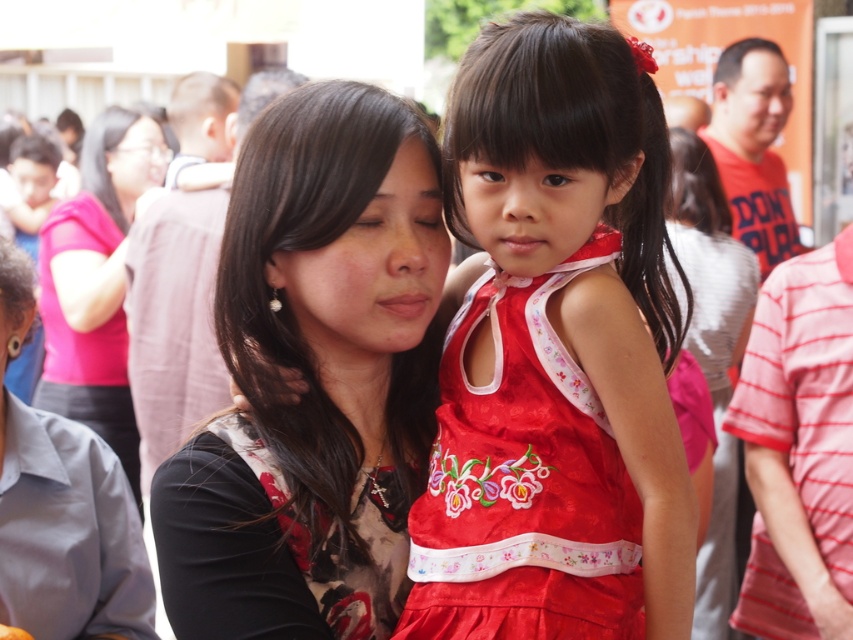
Question: Which object is the farthest from the black floral dress at center?

Choices:
 (A) matte black shirt at center
 (B) silky red dress at center

Answer: (A)

Question: Can you confirm if black floral dress at center is smaller than matte black shirt at center?

Choices:
 (A) yes
 (B) no

Answer: (A)

Question: Which object appears farthest from the camera in this image?

Choices:
 (A) silky red dress at center
 (B) black floral dress at center

Answer: (B)

Question: Is silky red dress at center wider than matte black shirt at center?

Choices:
 (A) no
 (B) yes

Answer: (A)

Question: Based on their relative distances, which object is nearer to the silky red dress at center?

Choices:
 (A) matte black shirt at center
 (B) black floral dress at center

Answer: (B)

Question: Is the position of silky red dress at center more distant than that of matte black shirt at center?

Choices:
 (A) no
 (B) yes

Answer: (A)